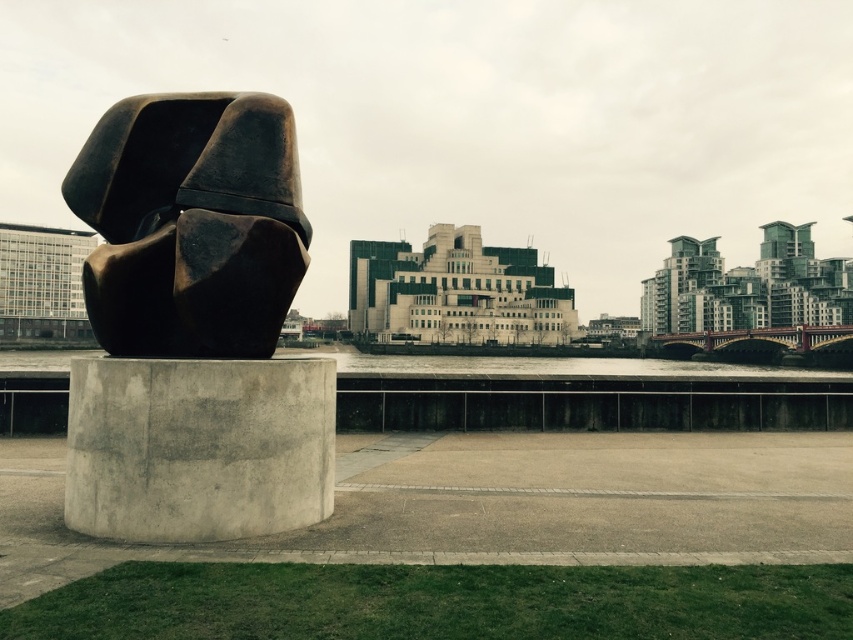
Is bronze sculpture at left positioned behind gray concrete at center?

Yes, bronze sculpture at left is behind gray concrete at center.

Does bronze sculpture at left appear under gray concrete at center?

Actually, bronze sculpture at left is above gray concrete at center.

Identify the location of bronze sculpture at left. (190, 225).

I want to click on bronze sculpture at left, so click(190, 225).